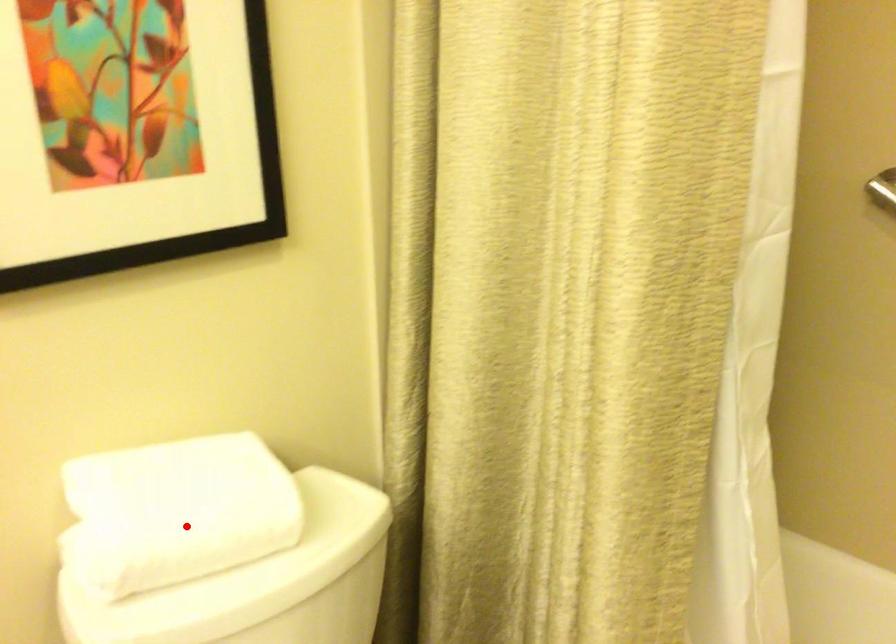
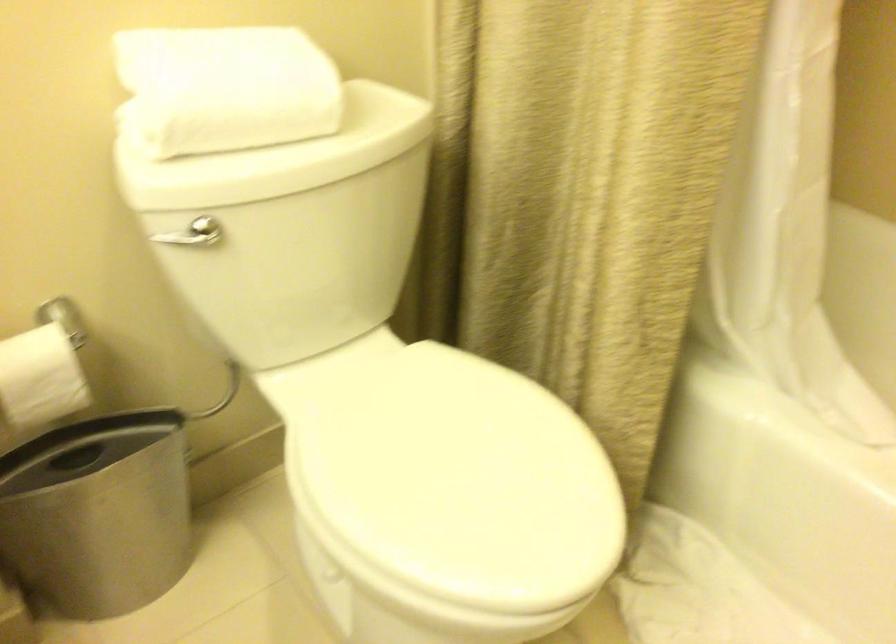
Find the pixel in the second image that matches the highlighted location in the first image.

(225, 88)